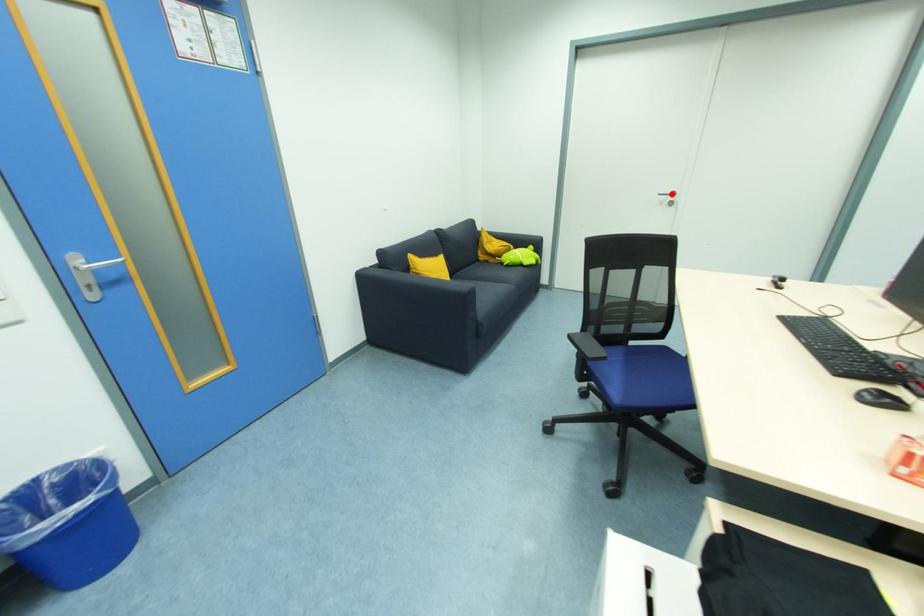
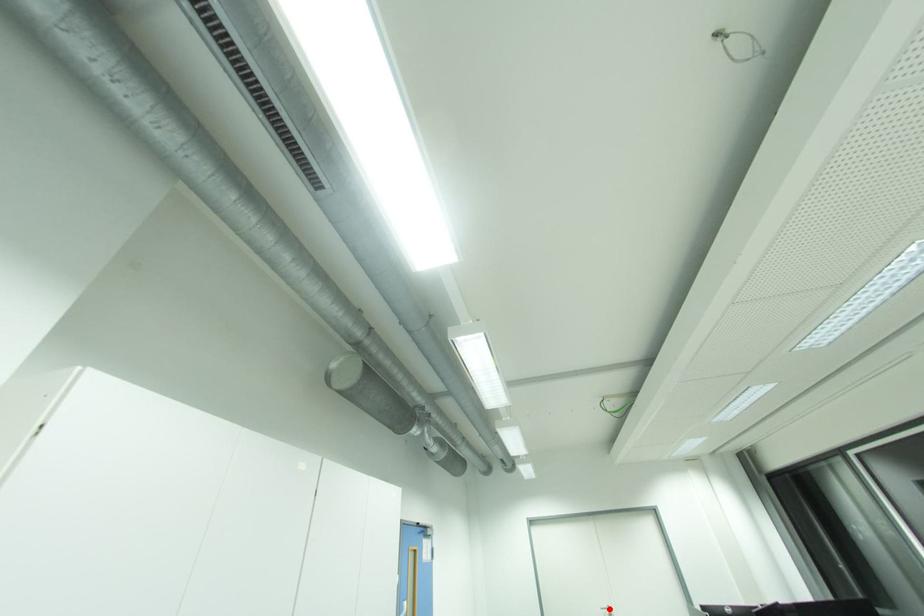
I am providing you with two images of the same scene from different viewpoints. A red point is marked on the first image and another point is marked on the second image. Are the points marked in image1 and image2 representing the same 3D position?

Yes